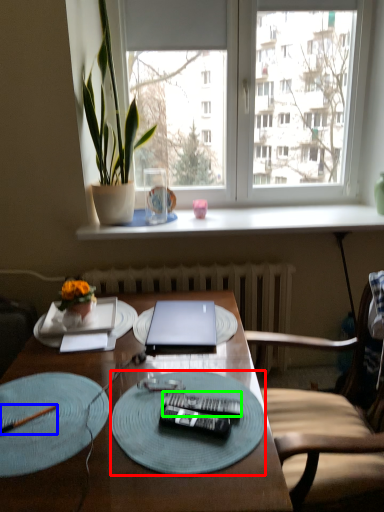
Question: Estimate the real-world distances between objects in this image. Which object is closer to glass plate (highlighted by a red box), pen (highlighted by a blue box) or remote control (highlighted by a green box)?

Choices:
 (A) pen
 (B) remote control

Answer: (B)